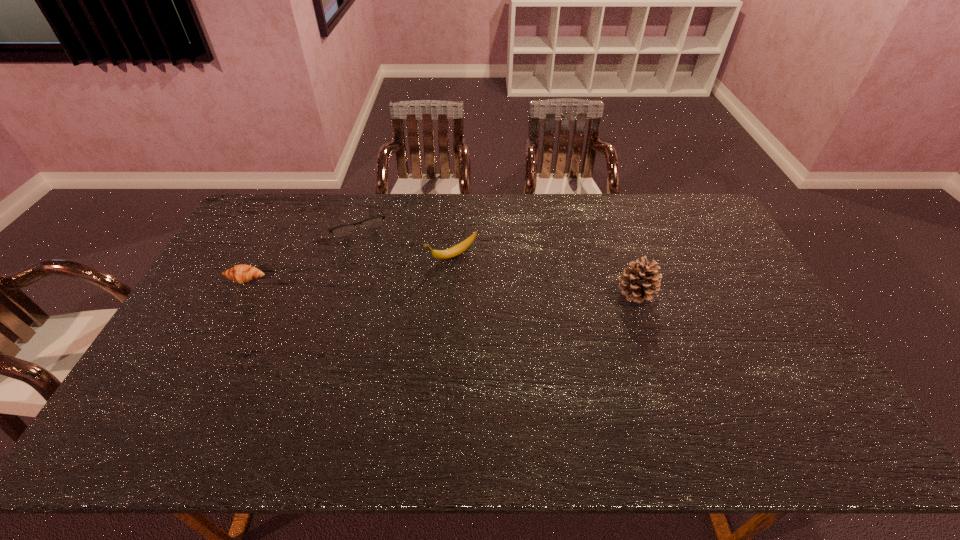
Where is `pastry`? The height and width of the screenshot is (540, 960). pastry is located at coordinates (242, 273).

You are a GUI agent. You are given a task and a screenshot of the screen. Output one action in this format:
    pyautogui.click(x=<x>, y=<y>)
    Task: Click on the pinecone
    
    Given the screenshot: What is the action you would take?
    pyautogui.click(x=639, y=283)

Locate an element on the screen. Image resolution: width=960 pixels, height=540 pixels. the rightmost object is located at coordinates (639, 283).

What are the coordinates of `the third object from right to left` in the screenshot? It's located at (344, 230).

The image size is (960, 540). What are the coordinates of `the farthest object` in the screenshot? It's located at (344, 230).

Where is `the third nearest object`? The image size is (960, 540). the third nearest object is located at coordinates (458, 249).

Find the location of a particular element. The width and height of the screenshot is (960, 540). the second tallest object is located at coordinates (458, 249).

Identify the location of free space located 0.200m on the front-facing side of the leftmost object. (214, 338).

Locate an element on the screen. The width and height of the screenshot is (960, 540). vacant space located 0.250m on the back of the rightmost object is located at coordinates (614, 229).

At what (x,y) coordinates should I click in order to perform the action: click on vacant space positioned 0.240m on the front-facing side of the second object from left to right. Please return your answer as a coordinate pair (x, y). Looking at the image, I should click on (381, 283).